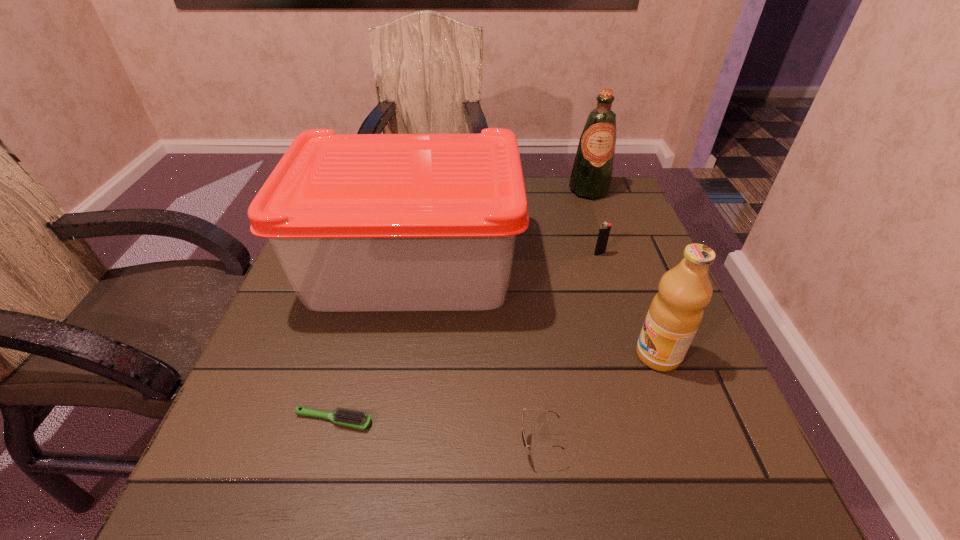
Find the location of `vacant space situated on the label of the fourth farthest object`. vacant space situated on the label of the fourth farthest object is located at coordinates (427, 355).

Where is `vacant space located on the front of the igniter`? Image resolution: width=960 pixels, height=540 pixels. vacant space located on the front of the igniter is located at coordinates (612, 293).

Where is `vacant space located in front of the lenses of the sunglasses`? This screenshot has height=540, width=960. vacant space located in front of the lenses of the sunglasses is located at coordinates (400, 446).

Identify the location of vacant region located in front of the lenses of the sunglasses. This screenshot has height=540, width=960. pos(328,446).

Where is `vacant area situated 0.170m in front of the lenses of the sunglasses`? This screenshot has height=540, width=960. vacant area situated 0.170m in front of the lenses of the sunglasses is located at coordinates (407, 446).

Where is `free spot located on the right of the shortest object`? This screenshot has width=960, height=540. free spot located on the right of the shortest object is located at coordinates [x=528, y=420].

Locate an element on the screen. Image resolution: width=960 pixels, height=540 pixels. olive oil present at the far edge is located at coordinates (591, 176).

I want to click on tray at the far edge, so click(x=359, y=222).

Locate an element on the screen. The width and height of the screenshot is (960, 540). object located at the near edge is located at coordinates (523, 431).

Locate an element on the screen. Image resolution: width=960 pixels, height=540 pixels. tray at the left edge is located at coordinates (359, 222).